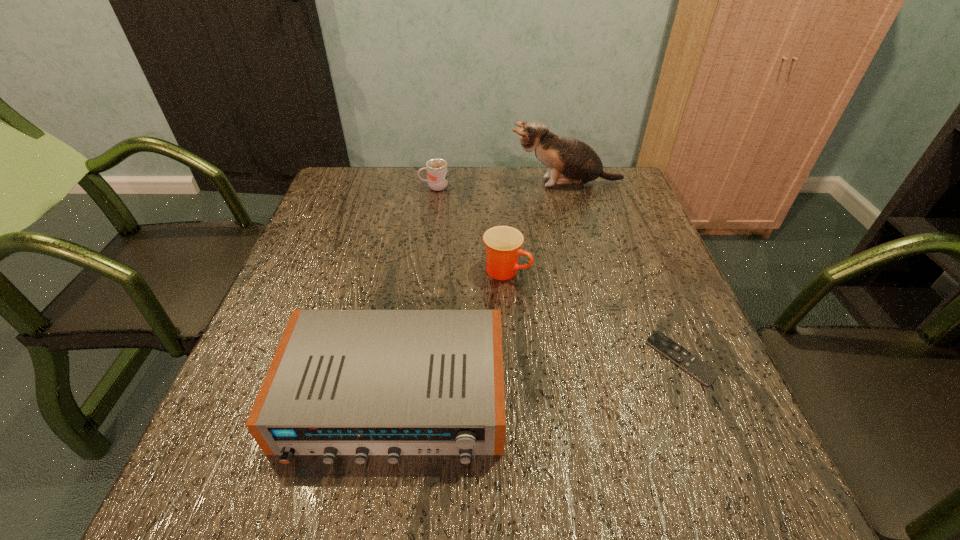
This screenshot has width=960, height=540. What are the coordinates of `free space between the farther cup and the tallest object` in the screenshot? It's located at 500,185.

Find the location of `vacant space in between the tallest object and the radio receiver`. vacant space in between the tallest object and the radio receiver is located at coordinates (480, 290).

At what (x,y) coordinates should I click in order to perform the action: click on blank region between the tallest object and the farther cup. Please return your answer as a coordinate pair (x, y). Looking at the image, I should click on (500, 185).

Find the location of a particular element. vacant space that is in between the third farthest object and the cat is located at coordinates (537, 227).

The image size is (960, 540). Find the location of `free space that is in between the farther cup and the nearer cup`. free space that is in between the farther cup and the nearer cup is located at coordinates (470, 229).

Where is `vacant area that lies between the left cup and the radio receiver`? The width and height of the screenshot is (960, 540). vacant area that lies between the left cup and the radio receiver is located at coordinates (415, 292).

At what (x,y) coordinates should I click in order to perform the action: click on object that is the closest to the third farthest object. Please return your answer as a coordinate pair (x, y). The image size is (960, 540). Looking at the image, I should click on (342, 382).

Locate which object ranks third in proximity to the shortest object. Please provide its 2D coordinates. Your answer should be formatted as a tuple, i.e. [(x, y)], where the tuple contains the x and y coordinates of a point satisfying the conditions above.

[(570, 162)]

Locate an element on the screen. vacant point that satisfies the following two spatial constraints: 1. on the side with the handle of the farther cup; 2. on the left side of the remote control is located at coordinates (411, 358).

Locate an element on the screen. The width and height of the screenshot is (960, 540). vacant space that satisfies the following two spatial constraints: 1. on the side with the handle of the remote control; 2. on the left side of the farther cup is located at coordinates (411, 358).